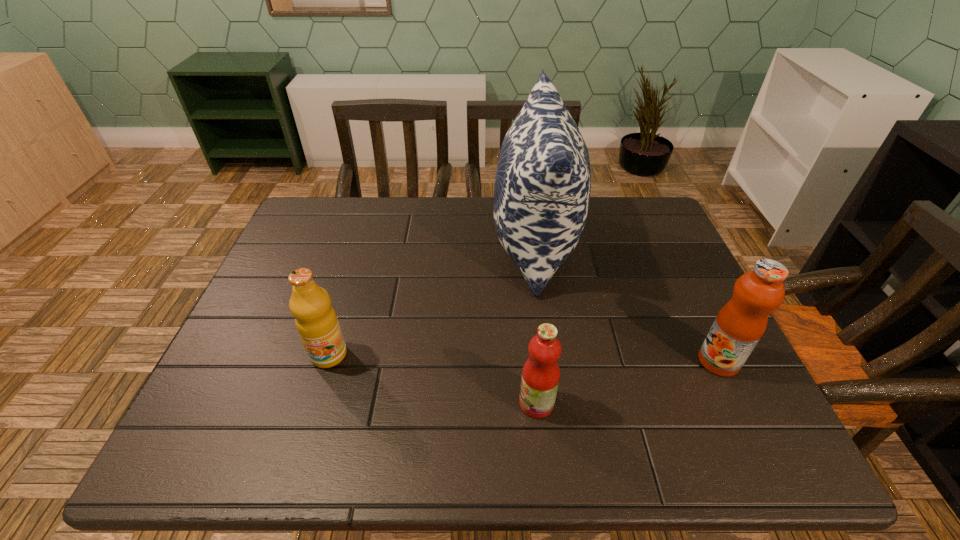
The width and height of the screenshot is (960, 540). In order to click on vacant space that satisfies the following two spatial constraints: 1. on the front surface of the farthest object; 2. on the front label of the leftmost fruit juice in this screenshot , I will do `click(550, 355)`.